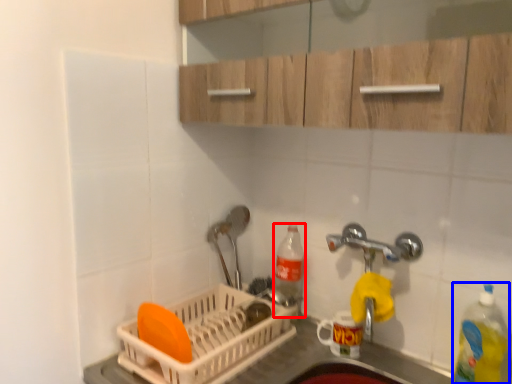
Question: Among these objects, which one is nearest to the camera, bottle (highlighted by a red box) or bottle (highlighted by a blue box)?

Choices:
 (A) bottle
 (B) bottle

Answer: (B)